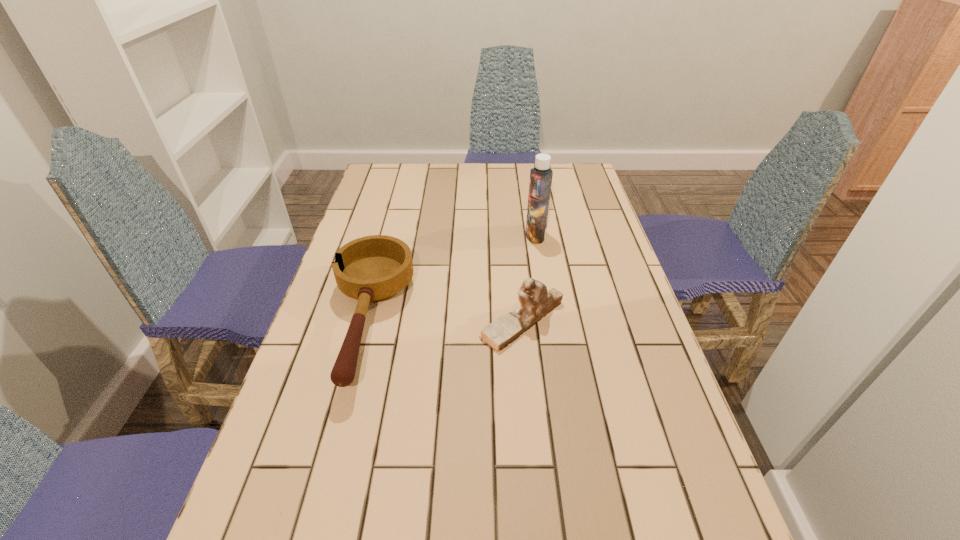
Where is `vacant space located 0.400m on the front-facing side of the figurine`? Image resolution: width=960 pixels, height=540 pixels. vacant space located 0.400m on the front-facing side of the figurine is located at coordinates (319, 320).

Where is `vacant space positioned 0.050m with the handle on the side of the leftmost object`? This screenshot has height=540, width=960. vacant space positioned 0.050m with the handle on the side of the leftmost object is located at coordinates (341, 425).

Where is `object that is at the left edge`? The width and height of the screenshot is (960, 540). object that is at the left edge is located at coordinates (375, 268).

Image resolution: width=960 pixels, height=540 pixels. I want to click on vacant region at the far edge of the desktop, so click(x=417, y=178).

Where is `free location at the left edge of the desktop`? The image size is (960, 540). free location at the left edge of the desktop is located at coordinates (368, 363).

Where is `free space at the right edge of the desktop`? free space at the right edge of the desktop is located at coordinates (659, 515).

The height and width of the screenshot is (540, 960). I want to click on vacant space at the far left corner of the desktop, so click(410, 195).

Image resolution: width=960 pixels, height=540 pixels. I want to click on free spot at the far right corner of the desktop, so click(x=560, y=187).

Where is `vacant space that's between the tallest object and the shortest object`? This screenshot has height=540, width=960. vacant space that's between the tallest object and the shortest object is located at coordinates (452, 278).

At what (x,y) coordinates should I click in order to perform the action: click on vacant space that's between the leftmost object and the farthest object. Please return your answer as a coordinate pair (x, y). The image size is (960, 540). Looking at the image, I should click on (452, 278).